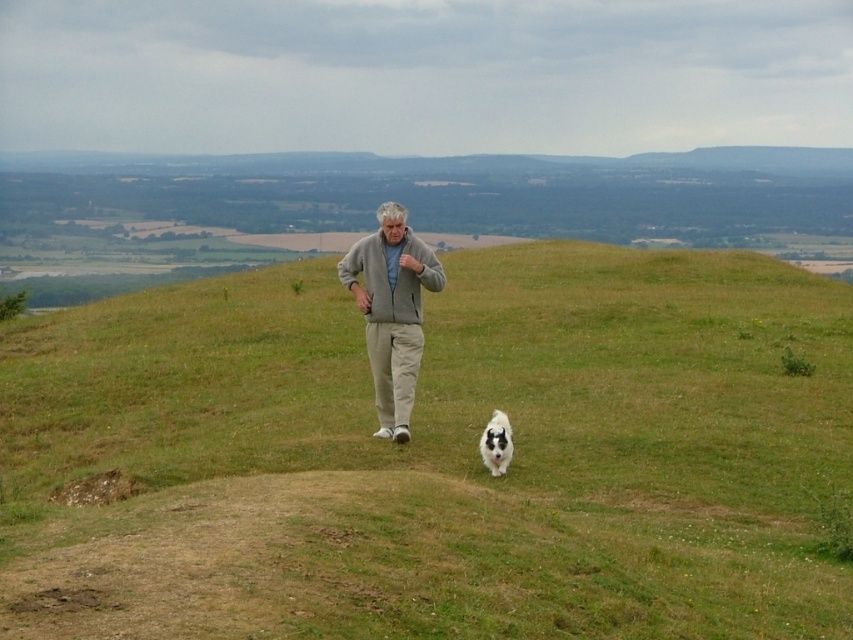
The height and width of the screenshot is (640, 853). In order to click on green grassy hill at center in this screenshot , I will do `click(436, 456)`.

Is green grassy hill at center below light gray zip-up sweater at center?

Actually, green grassy hill at center is above light gray zip-up sweater at center.

The width and height of the screenshot is (853, 640). I want to click on green grassy hill at center, so click(436, 456).

Where is `green grassy hill at center`? This screenshot has width=853, height=640. green grassy hill at center is located at coordinates (436, 456).

Between light gray zip-up sweater at center and white fluffy dog at lower center, which one has less height?

white fluffy dog at lower center

Locate an element on the screen. light gray zip-up sweater at center is located at coordinates (392, 310).

Consider the image. Does green grassy hill at center lie behind white fluffy dog at lower center?

That is False.

Which is more to the right, green grassy hill at center or white fluffy dog at lower center?

From the viewer's perspective, white fluffy dog at lower center appears more on the right side.

Which is in front, point (293, 595) or point (508, 436)?

Point (293, 595)

Where is `green grassy hill at center`? green grassy hill at center is located at coordinates (436, 456).